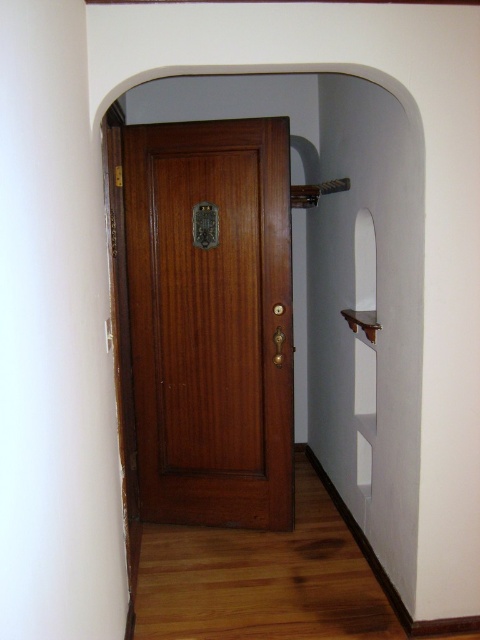
Question: From the image, what is the correct spatial relationship of polished wood door at center in relation to wooden door at center?

Choices:
 (A) below
 (B) above

Answer: (A)

Question: Can you confirm if polished wood door at center is thinner than wooden door at center?

Choices:
 (A) no
 (B) yes

Answer: (B)

Question: Among these points, which one is nearest to the camera?

Choices:
 (A) (218, 456)
 (B) (330, 412)

Answer: (A)

Question: Which point is closer to the camera taking this photo?

Choices:
 (A) (274, 276)
 (B) (201, 77)

Answer: (A)

Question: Is polished wood door at center to the right of wooden door at center from the viewer's perspective?

Choices:
 (A) yes
 (B) no

Answer: (B)